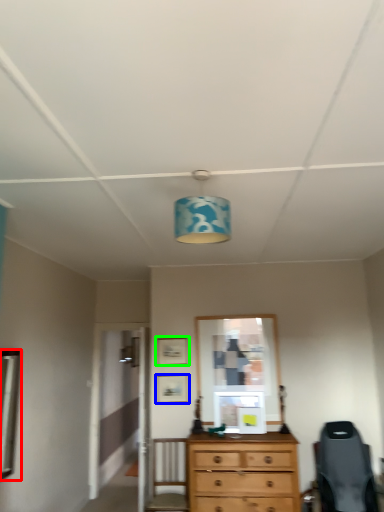
Question: Which object is positioned farthest from mirror (highlighted by a red box)? Select from picture frame (highlighted by a blue box) and picture frame (highlighted by a green box).

Choices:
 (A) picture frame
 (B) picture frame

Answer: (B)